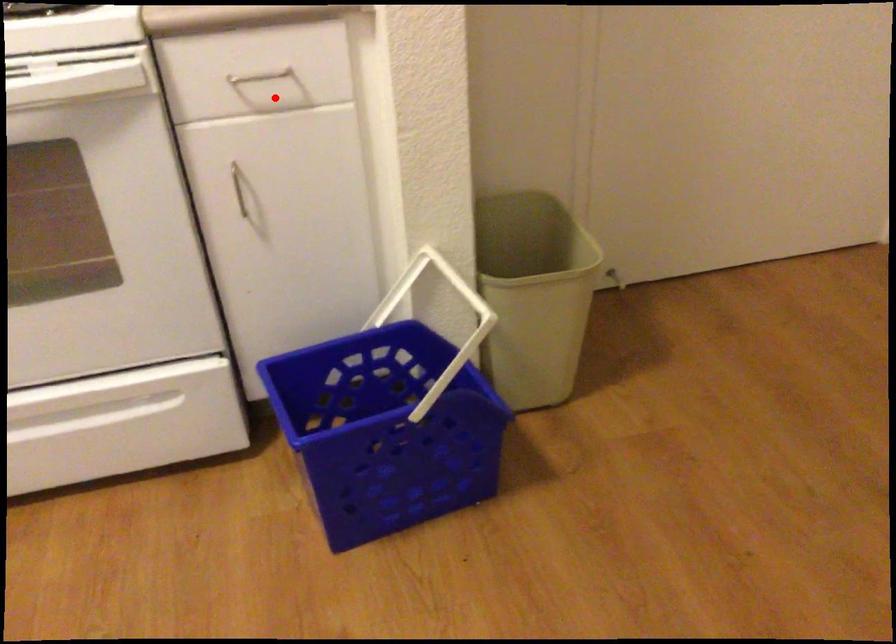
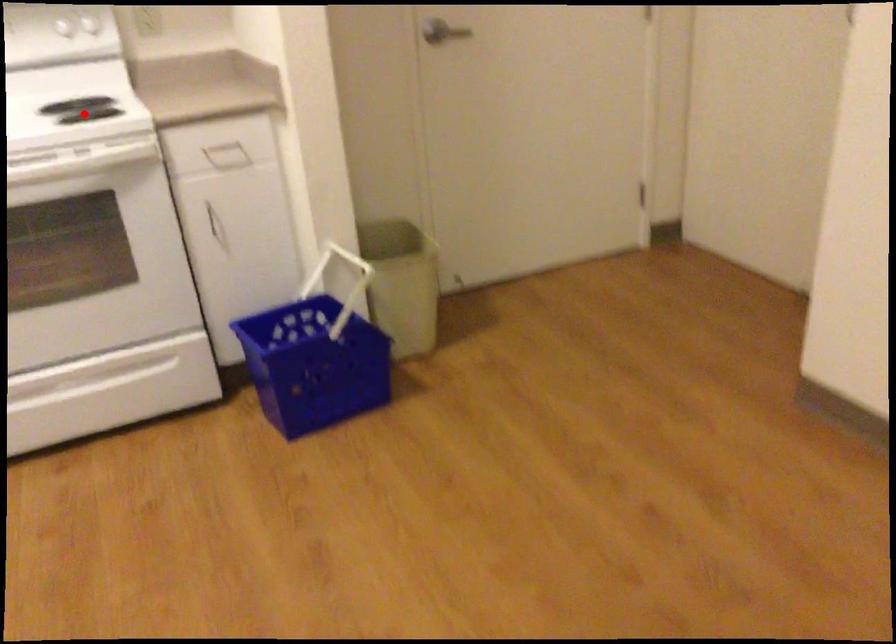
I am providing you with two images of the same scene from different viewpoints. A red point is marked on the first image and another point is marked on the second image. Does the point marked in image1 correspond to the same location as the one in image2?

No